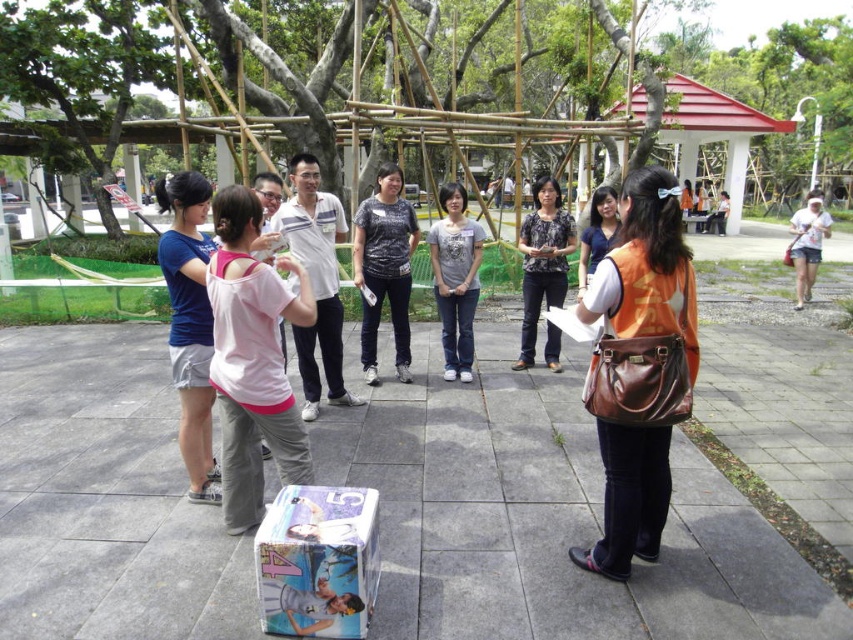
Question: Among these points, which one is farthest from the camera?

Choices:
 (A) (589, 246)
 (B) (566, 221)
 (C) (639, 525)

Answer: (B)

Question: Is the position of white striped shirt at center more distant than that of white cotton shirt at right?

Choices:
 (A) no
 (B) yes

Answer: (A)

Question: Which is farther from the blue fabric shorts at left?

Choices:
 (A) matte gray shirt at center
 (B) camouflage shirt at center
 (C) black floral blouse at center

Answer: (C)

Question: Is white cotton shirt at right further to the viewer compared to matte blue shirt at center?

Choices:
 (A) no
 (B) yes

Answer: (B)

Question: Does white striped shirt at center appear under camouflage shirt at center?

Choices:
 (A) yes
 (B) no

Answer: (A)

Question: Among these objects, which one is nearest to the camera?

Choices:
 (A) camouflage shirt at center
 (B) matte gray shirt at center

Answer: (A)